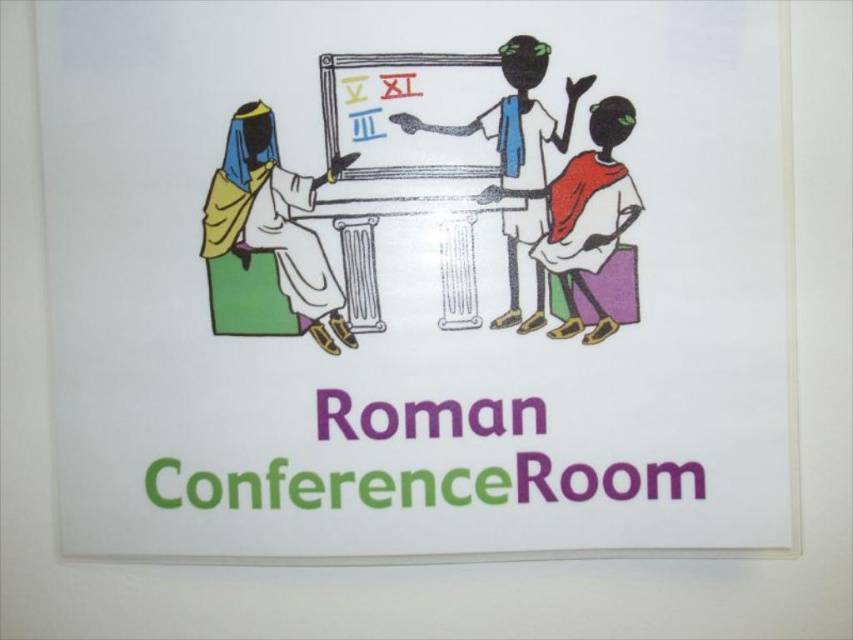
Question: Is matte red dress at center further to the viewer compared to matte whiteboard at center?

Choices:
 (A) no
 (B) yes

Answer: (B)

Question: Does matte red dress at center have a lesser width compared to matte whiteboard at center?

Choices:
 (A) no
 (B) yes

Answer: (B)

Question: Among these points, which one is farthest from the camera?

Choices:
 (A) (509, 480)
 (B) (289, 276)
 (C) (498, 112)

Answer: (A)

Question: Which object is positioned closest to the matte whiteboard at center?

Choices:
 (A) matte yellow fabric at left
 (B) whiteboard at center
 (C) matte red dress at center

Answer: (C)

Question: Estimate the real-world distances between objects in this image. Which object is farther from the whiteboard at center?

Choices:
 (A) matte yellow fabric at left
 (B) matte whiteboard at center

Answer: (A)

Question: Can you confirm if purple paper roman conference room at center is wider than matte red dress at center?

Choices:
 (A) yes
 (B) no

Answer: (A)